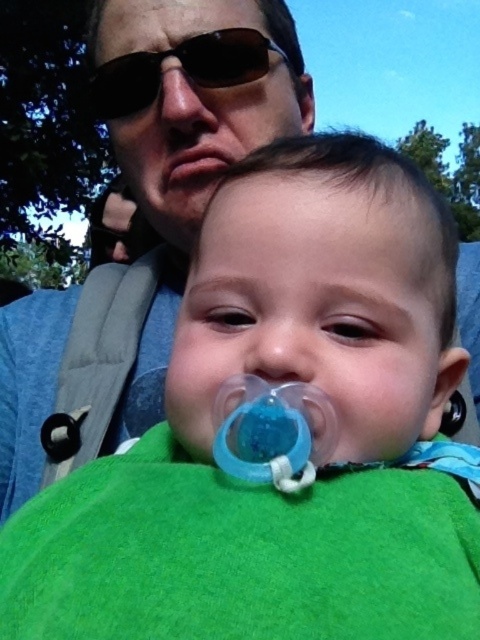
Is black plastic sunglasses at upper center below pink flesh at center?

Actually, black plastic sunglasses at upper center is above pink flesh at center.

How distant is black plastic sunglasses at upper center from pink flesh at center?

A distance of 8.03 centimeters exists between black plastic sunglasses at upper center and pink flesh at center.

Where is `black plastic sunglasses at upper center`? black plastic sunglasses at upper center is located at coordinates (182, 68).

At what (x,y) coordinates should I click in order to perform the action: click on black plastic sunglasses at upper center. Please return your answer as a coordinate pair (x, y). Image resolution: width=480 pixels, height=640 pixels. Looking at the image, I should click on (182, 68).